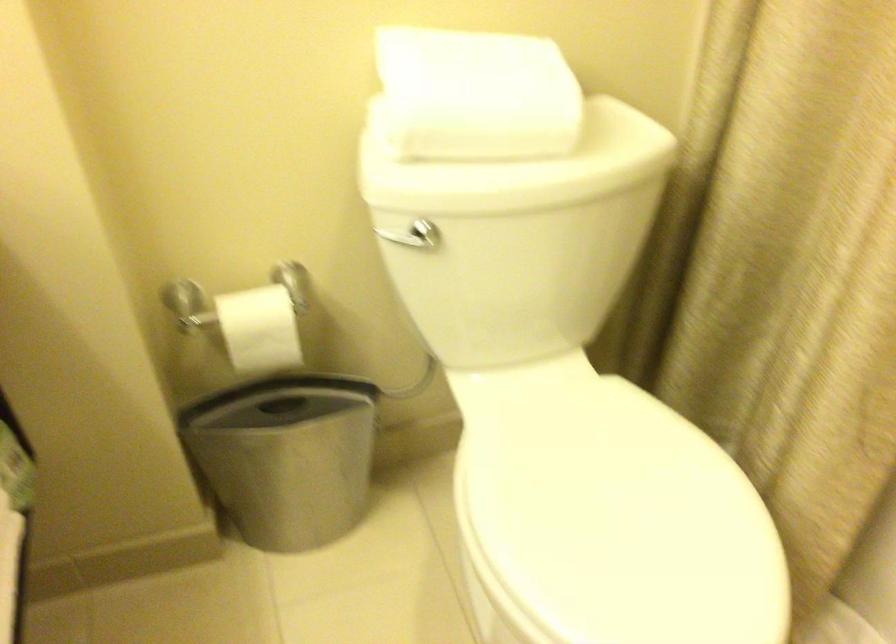
Describe the element at coordinates (613, 518) in the screenshot. The height and width of the screenshot is (644, 896). I see `the white toilet lid` at that location.